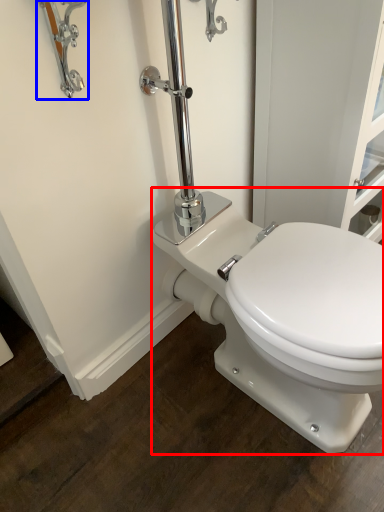
Question: Which point is further to the camera, toilet (highlighted by a red box) or faucet (highlighted by a blue box)?

Choices:
 (A) toilet
 (B) faucet

Answer: (A)